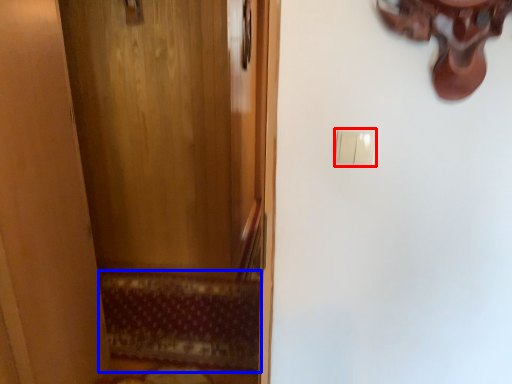
Question: Which object appears closest to the camera in this image, light switch (highlighted by a red box) or doormat (highlighted by a blue box)?

Choices:
 (A) light switch
 (B) doormat

Answer: (A)